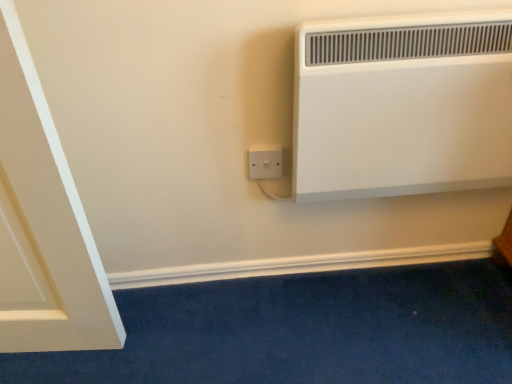
Locate an element on the screen. white plastic socket at lower center is located at coordinates (265, 162).

The height and width of the screenshot is (384, 512). What do you see at coordinates (265, 162) in the screenshot?
I see `white plastic socket at lower center` at bounding box center [265, 162].

Measure the distance between point (482, 175) and camera.

Point (482, 175) and camera are 1.01 meters apart.

Describe the element at coordinates (402, 105) in the screenshot. I see `white matte heater at upper right` at that location.

Identify the location of white matte heater at upper right. The height and width of the screenshot is (384, 512). (402, 105).

Identify the location of white plastic socket at lower center. (265, 162).

Can you confirm if white matte heater at upper right is positioned to the left of white plastic socket at lower center?

In fact, white matte heater at upper right is to the right of white plastic socket at lower center.

Which object is closer to the camera taking this photo, white matte heater at upper right or white plastic socket at lower center?

white matte heater at upper right is more forward.

Is point (501, 123) closer to camera compared to point (264, 146)?

Yes.

Looking at this image, from the image's perspective, would you say white matte heater at upper right is shown under white plastic socket at lower center?

No, from the image's perspective, white matte heater at upper right is not below white plastic socket at lower center.

From a real-world perspective, does white matte heater at upper right stand above white plastic socket at lower center?

Indeed, from a real-world perspective, white matte heater at upper right stands above white plastic socket at lower center.

Which object is thinner, white matte heater at upper right or white plastic socket at lower center?

With smaller width is white plastic socket at lower center.

From their relative heights in the image, would you say white matte heater at upper right is taller or shorter than white plastic socket at lower center?

In the image, white matte heater at upper right appears to be taller than white plastic socket at lower center.

Which of these two, white matte heater at upper right or white plastic socket at lower center, is smaller?

white plastic socket at lower center.

In the scene shown: Can we say white matte heater at upper right lies outside white plastic socket at lower center?

white matte heater at upper right is positioned outside white plastic socket at lower center.

Is white matte heater at upper right not near white plastic socket at lower center?

white matte heater at upper right is actually quite close to white plastic socket at lower center.

Is white matte heater at upper right oriented away from white plastic socket at lower center?

No, white matte heater at upper right's orientation is not away from white plastic socket at lower center.

Can you tell me how much white matte heater at upper right and white plastic socket at lower center differ in facing direction?

1.57 degrees separate the facing orientations of white matte heater at upper right and white plastic socket at lower center.

This screenshot has height=384, width=512. I want to click on power plugs and sockets that appears behind the white matte heater at upper right, so click(265, 162).

Considering the relative positions of white plastic socket at lower center and white matte heater at upper right in the image provided, is white plastic socket at lower center to the left or to the right of white matte heater at upper right?

Clearly, white plastic socket at lower center is on the left of white matte heater at upper right in the image.

Is white plastic socket at lower center in front of or behind white matte heater at upper right in the image?

white plastic socket at lower center is behind white matte heater at upper right.

Which point is more forward, [279,157] or [398,103]?

The point [398,103] is closer to the camera.

From the image's perspective, does white plastic socket at lower center appear lower than white matte heater at upper right?

Indeed, from the image's perspective, white plastic socket at lower center is shown beneath white matte heater at upper right.

From a real-world perspective, which object rests below the other?

From a 3D spatial view, white plastic socket at lower center is below.

Is white plastic socket at lower center wider or thinner than white matte heater at upper right?

white plastic socket at lower center is thinner than white matte heater at upper right.

Considering the sizes of white plastic socket at lower center and white matte heater at upper right in the image, is white plastic socket at lower center taller or shorter than white matte heater at upper right?

Considering their sizes, white plastic socket at lower center has less height than white matte heater at upper right.

Who is smaller, white plastic socket at lower center or white matte heater at upper right?

white plastic socket at lower center.

Is white plastic socket at lower center not inside white matte heater at upper right?

white plastic socket at lower center lies outside white matte heater at upper right's area.

Looking at this image, is the surface of white plastic socket at lower center in direct contact with white matte heater at upper right?

No, white plastic socket at lower center is not making contact with white matte heater at upper right.

Consider the image. Is white plastic socket at lower center oriented towards white matte heater at upper right?

No, white plastic socket at lower center is not facing towards white matte heater at upper right.

Can you tell me how much white plastic socket at lower center and white matte heater at upper right differ in facing direction?

white plastic socket at lower center and white matte heater at upper right are facing 1.57 degrees away from each other.

Locate an element on the screen. The image size is (512, 384). heater that appears in front of the white plastic socket at lower center is located at coordinates coord(402,105).

The image size is (512, 384). Find the location of `heater that appears above the white plastic socket at lower center (from the image's perspective)`. heater that appears above the white plastic socket at lower center (from the image's perspective) is located at coordinates (402, 105).

You are a GUI agent. You are given a task and a screenshot of the screen. Output one action in this format:
    pyautogui.click(x=<x>, y=<y>)
    Task: Click on the power plugs and sockets behind the white matte heater at upper right
    
    Given the screenshot: What is the action you would take?
    pyautogui.click(x=265, y=162)